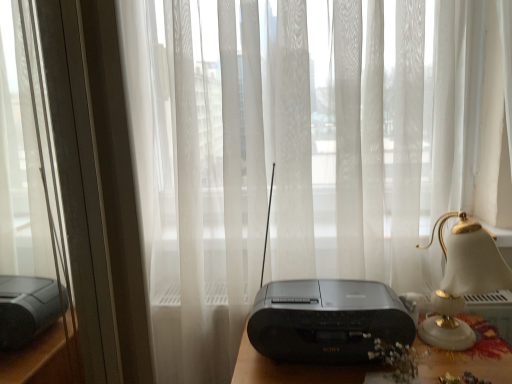
Question: Considering the relative sizes of black plastic radio at center and black plastic radio at center in the image provided, is black plastic radio at center taller than black plastic radio at center?

Choices:
 (A) yes
 (B) no

Answer: (B)

Question: Is black plastic radio at center at the left side of black plastic radio at center?

Choices:
 (A) yes
 (B) no

Answer: (A)

Question: Can you confirm if black plastic radio at center is shorter than black plastic radio at center?

Choices:
 (A) no
 (B) yes

Answer: (B)

Question: Is black plastic radio at center smaller than black plastic radio at center?

Choices:
 (A) yes
 (B) no

Answer: (A)

Question: Is black plastic radio at center in front of black plastic radio at center?

Choices:
 (A) yes
 (B) no

Answer: (B)

Question: From a real-world perspective, is metallic silver window frame at left above or below white glossy bedside lamp at right?

Choices:
 (A) below
 (B) above

Answer: (B)

Question: From the image's perspective, is metallic silver window frame at left positioned above or below white glossy bedside lamp at right?

Choices:
 (A) above
 (B) below

Answer: (A)

Question: Is metallic silver window frame at left inside the boundaries of white glossy bedside lamp at right, or outside?

Choices:
 (A) outside
 (B) inside

Answer: (A)

Question: Would you say metallic silver window frame at left is to the left or to the right of white glossy bedside lamp at right in the picture?

Choices:
 (A) right
 (B) left

Answer: (B)

Question: Looking at the image, does black plastic radio at center seem bigger or smaller compared to metallic silver window frame at left?

Choices:
 (A) big
 (B) small

Answer: (B)

Question: Is black plastic radio at center to the left or to the right of metallic silver window frame at left in the image?

Choices:
 (A) left
 (B) right

Answer: (B)

Question: Which is correct: black plastic radio at center is inside metallic silver window frame at left, or outside of it?

Choices:
 (A) outside
 (B) inside

Answer: (A)

Question: From a real-world perspective, relative to metallic silver window frame at left, is black plastic radio at center vertically above or below?

Choices:
 (A) below
 (B) above

Answer: (A)

Question: Is white glossy bedside lamp at right inside or outside of black plastic radio at center?

Choices:
 (A) outside
 (B) inside

Answer: (A)

Question: From the image's perspective, is white glossy bedside lamp at right located above or below black plastic radio at center?

Choices:
 (A) above
 (B) below

Answer: (B)